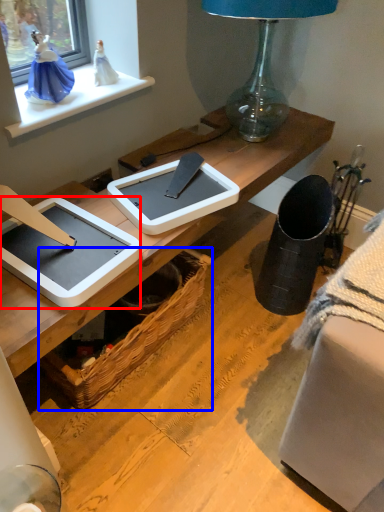
Question: Among these objects, which one is nearest to the camera, tablet computer (highlighted by a red box) or picnic basket (highlighted by a blue box)?

Choices:
 (A) tablet computer
 (B) picnic basket

Answer: (A)